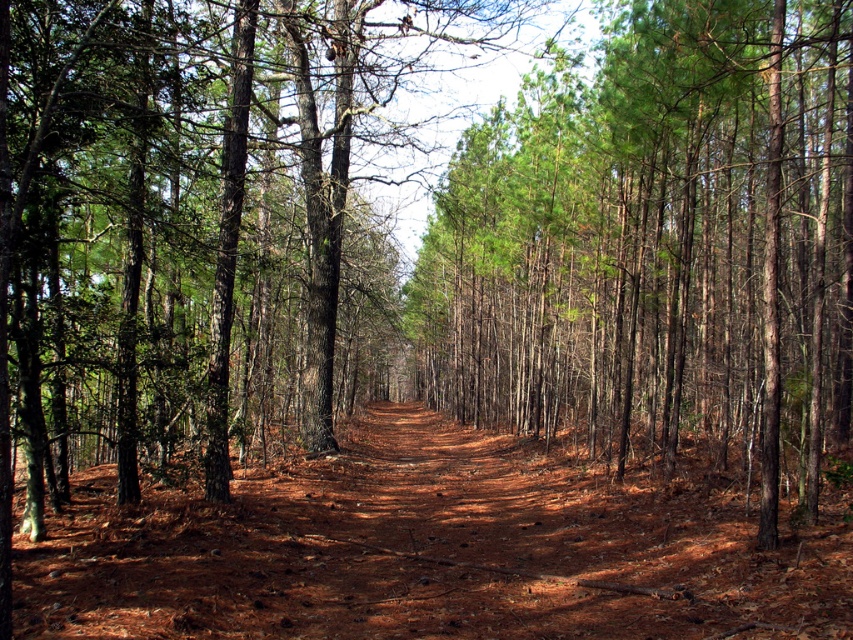
Question: In this image, where is green smooth tree at center located relative to brown dirt track at center?

Choices:
 (A) left
 (B) right

Answer: (B)

Question: Which point appears farthest from the camera in this image?

Choices:
 (A) (732, 170)
 (B) (480, 568)

Answer: (A)

Question: Does green smooth tree at center have a greater width compared to brown dirt track at center?

Choices:
 (A) yes
 (B) no

Answer: (B)

Question: Can you confirm if green smooth tree at center is positioned to the left of brown dirt track at center?

Choices:
 (A) no
 (B) yes

Answer: (A)

Question: Among these points, which one is nearest to the camera?

Choices:
 (A) (421, 436)
 (B) (657, 403)

Answer: (B)